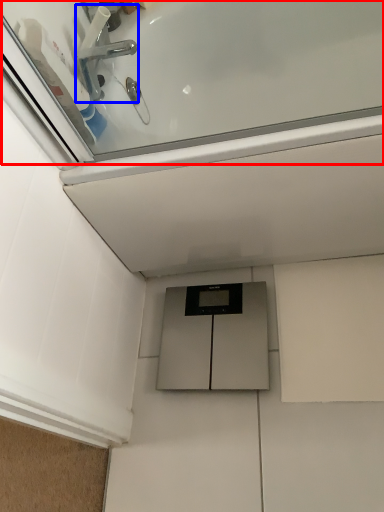
Question: Which of the following is the farthest to the observer, bath (highlighted by a red box) or tap (highlighted by a blue box)?

Choices:
 (A) bath
 (B) tap

Answer: (B)